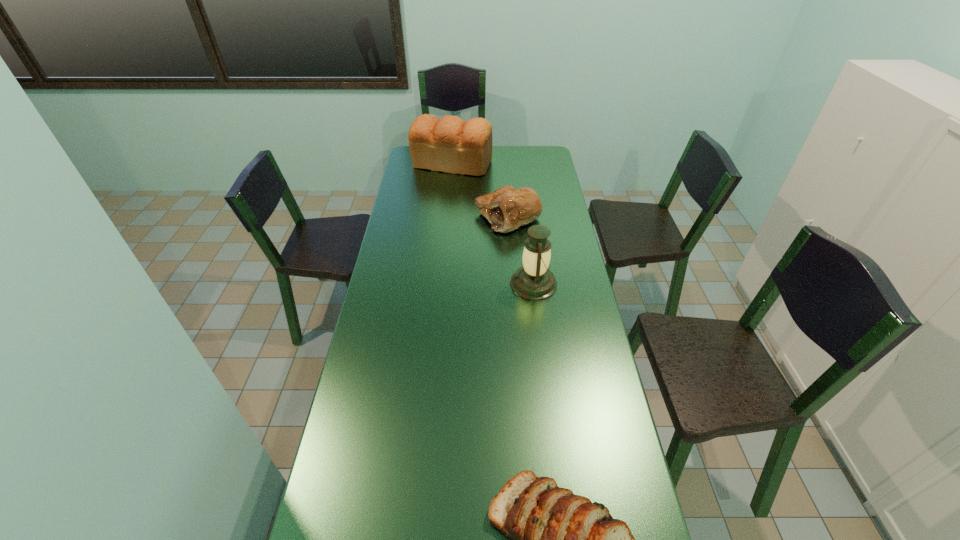
Find the location of `vacant region between the lantern and the third tallest object`. vacant region between the lantern and the third tallest object is located at coordinates (520, 250).

This screenshot has width=960, height=540. In order to click on vacant area that lies between the farthest bread and the second tallest bread in this screenshot , I will do `click(480, 191)`.

Locate an element on the screen. the second closest object relative to the farthest bread is located at coordinates (534, 281).

Select which object appears as the closest to the second farthest bread. Please provide its 2D coordinates. Your answer should be formatted as a tuple, i.e. [(x, y)], where the tuple contains the x and y coordinates of a point satisfying the conditions above.

[(450, 144)]

Find the location of a particular element. This screenshot has width=960, height=540. bread object that ranks as the second closest to the tallest bread is located at coordinates (560, 539).

Find the location of a particular element. bread object that ranks as the second closest to the farthest object is located at coordinates (560, 539).